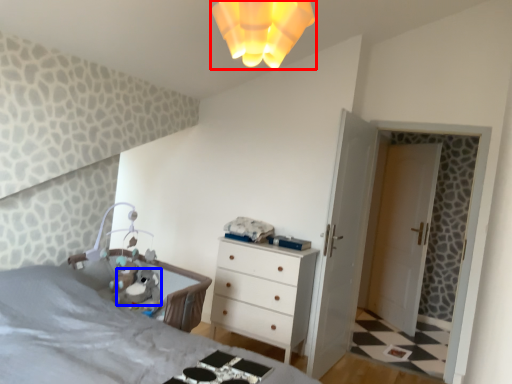
Question: Among these objects, which one is farthest to the camera, light fixture (highlighted by a red box) or animal (highlighted by a blue box)?

Choices:
 (A) light fixture
 (B) animal

Answer: (B)